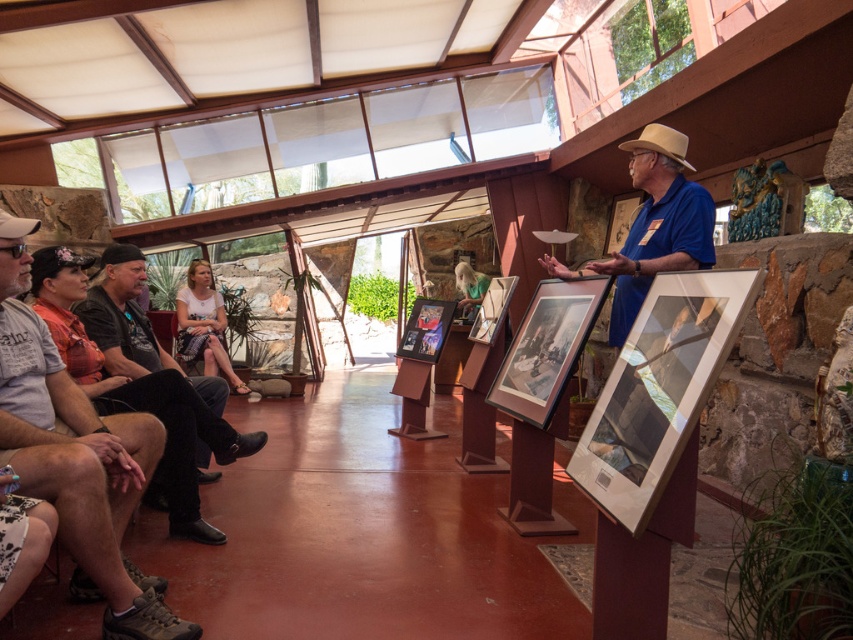
Question: Which object is farther from the camera taking this photo?

Choices:
 (A) white cotton shirt at center
 (B) dark gray shirt at left
 (C) matte brown cowboy hat at upper left
 (D) blue cotton shirt at center

Answer: (A)

Question: Is blue cotton shirt at center above blonde hair at center?

Choices:
 (A) yes
 (B) no

Answer: (A)

Question: Which point is farther from the camera taking this photo?

Choices:
 (A) (675, 147)
 (B) (22, 445)
 (C) (669, 125)
 (D) (219, 394)

Answer: (C)

Question: Which point is farther to the camera?

Choices:
 (A) (154, 365)
 (B) (9, 390)
 (C) (180, 324)
 (D) (683, 148)

Answer: (C)

Question: Does dark gray shirt at left have a larger size compared to white cotton shirt at center?

Choices:
 (A) yes
 (B) no

Answer: (B)

Question: Considering the relative positions of blue cotton shirt at center and tan straw cowboy hat at upper center in the image provided, where is blue cotton shirt at center located with respect to tan straw cowboy hat at upper center?

Choices:
 (A) left
 (B) right

Answer: (A)